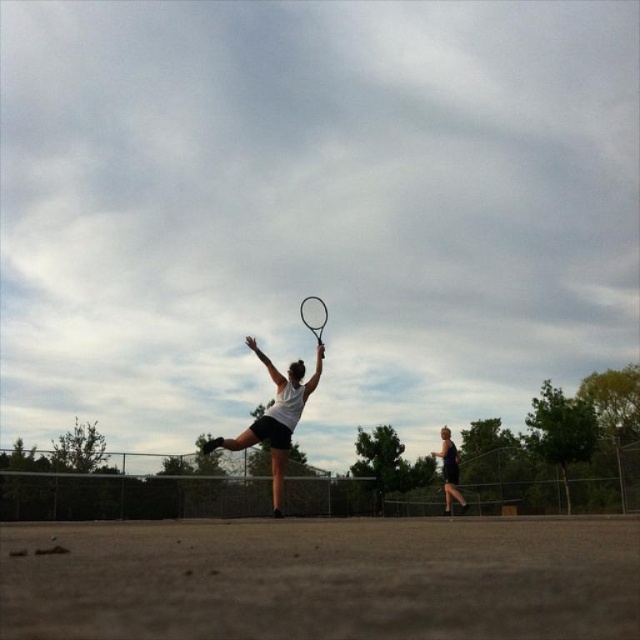
You are a tennis coach observing the serve. Which object is closer to the viewer between the black matte tennis racket at center and the purple fabric shorts at right?

The purple fabric shorts at right are closer to the viewer because the black matte tennis racket at center is positioned behind them.

You are a photographer positioned at the center of the tennis court. You want to capture a photo of the purple fabric shorts at right and the black matte tennis racket at center. Based on their positions, which object is located to the right of the other?

The purple fabric shorts at right is positioned on the right side of black matte tennis racket at center, so the purple fabric shorts at right is to the right of the black matte tennis racket at center.